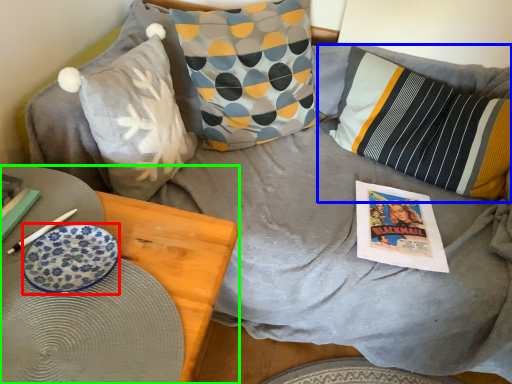
Question: Which object is positioned closest to plate (highlighted by a red box)? Select from pillow (highlighted by a blue box) and furniture (highlighted by a green box).

Choices:
 (A) pillow
 (B) furniture

Answer: (B)